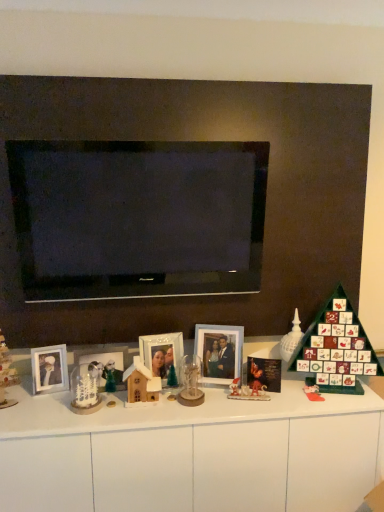
Question: Considering their positions, is matte plastic toy at right, which is counted as the second toy, starting from the front, located in front of or behind clear glass candle holder at center, arranged as the 2th candle holder when viewed from the left?

Choices:
 (A) behind
 (B) front

Answer: (A)

Question: Is matte plastic toy at right, which is the 3th toy in left-to-right order, spatially inside clear glass candle holder at center, arranged as the 2th candle holder when viewed from the left, or outside of it?

Choices:
 (A) outside
 (B) inside

Answer: (A)

Question: Estimate the real-world distances between objects in this image. Which object is farther from the white frosted glass candle holder at lower left, arranged as the 2th candle holder when viewed from the right?

Choices:
 (A) white glossy seashell at right, which is the second toy from right to left
 (B) matte white glass dome at lower left
 (C) matte plastic toy at right, the first toy positioned from the right
 (D) white glossy dresser at center
 (E) wooden house at center, the first toy from the left

Answer: (C)

Question: Estimate the real-world distances between objects in this image. Which object is farther from the matte white glass dome at lower left?

Choices:
 (A) wooden house at center, which appears as the first toy when viewed from the front
 (B) clear glass candle holder at center, arranged as the 2th candle holder when viewed from the left
 (C) green matte advent calendar at right
 (D) white glossy dresser at center
 (E) matte silver picture frame at left, the 3th picture frame viewed from the right

Answer: (C)